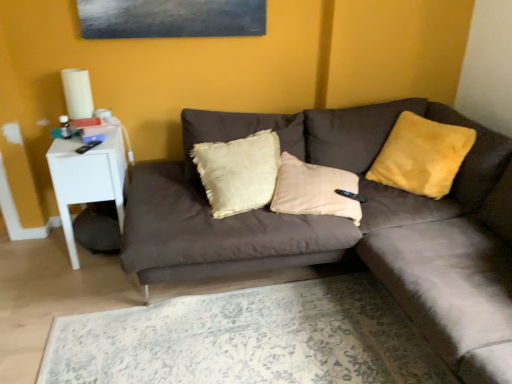
Question: Is white glossy side table at left thinner than yellow fuzzy pillow at upper right?

Choices:
 (A) yes
 (B) no

Answer: (B)

Question: Would you say white glossy side table at left is a long distance from yellow fuzzy pillow at upper right?

Choices:
 (A) no
 (B) yes

Answer: (B)

Question: Is the position of white glossy side table at left more distant than that of yellow fuzzy pillow at upper right?

Choices:
 (A) no
 (B) yes

Answer: (B)

Question: Is white glossy side table at left oriented away from yellow fuzzy pillow at upper right?

Choices:
 (A) no
 (B) yes

Answer: (A)

Question: Is white glossy side table at left smaller than yellow fuzzy pillow at upper right?

Choices:
 (A) no
 (B) yes

Answer: (A)

Question: Does white glossy side table at left appear on the left side of yellow fuzzy pillow at upper right?

Choices:
 (A) no
 (B) yes

Answer: (B)

Question: Can you confirm if velvet brown couch at center is positioned to the left of yellow fuzzy pillow at upper right?

Choices:
 (A) no
 (B) yes

Answer: (B)

Question: Can you see velvet brown couch at center touching yellow fuzzy pillow at upper right?

Choices:
 (A) no
 (B) yes

Answer: (A)

Question: Is velvet brown couch at center turned away from yellow fuzzy pillow at upper right?

Choices:
 (A) yes
 (B) no

Answer: (A)

Question: Would you say velvet brown couch at center is outside yellow fuzzy pillow at upper right?

Choices:
 (A) yes
 (B) no

Answer: (A)

Question: Can you confirm if velvet brown couch at center is bigger than yellow fuzzy pillow at upper right?

Choices:
 (A) no
 (B) yes

Answer: (B)

Question: From a real-world perspective, does velvet brown couch at center sit lower than yellow fuzzy pillow at upper right?

Choices:
 (A) yes
 (B) no

Answer: (A)

Question: Is velvet brown couch at center shorter than white glossy side table at left?

Choices:
 (A) no
 (B) yes

Answer: (B)